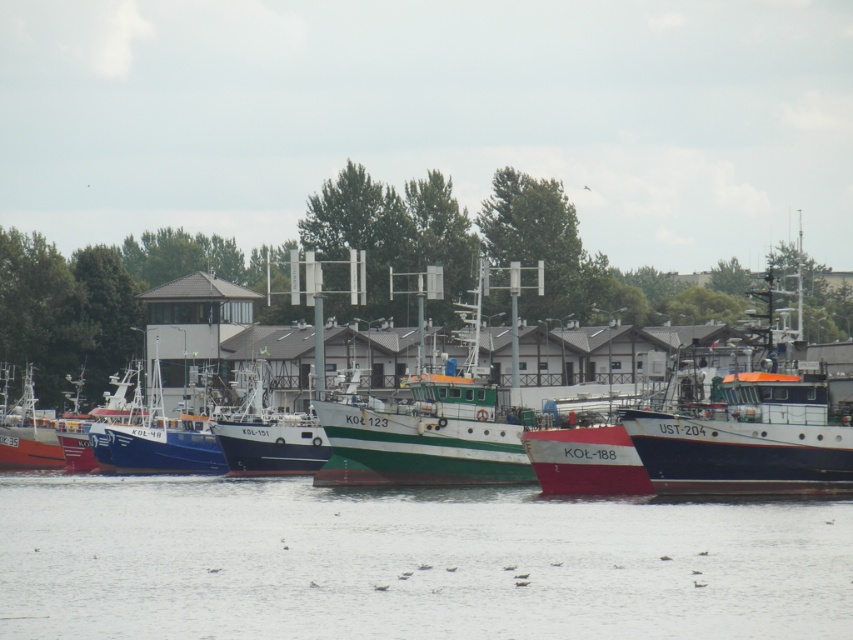
You are standing at the edge of the marina and want to board the green matte boat at center. The clear water at center is between you and the boat. Can you step onto the boat without getting your feet wet?

The clear water at center is 24.33 meters away from the green matte boat at center, so you would have to walk through 24.33 meters of water to reach the boat. This distance is too far to step onto the boat without getting your feet wet.

You are a boat operator who needs to navigate through the marina. You see the clear water at center and the green matte boat at center. Which object is smaller in size?

The clear water at center has a smaller size compared to the green matte boat at center.

Consider the image. You are standing at the pier and see the green matte boat at center and the blue matte boat at center. Which boat is positioned to the right of the other?

The green matte boat at center is positioned to the right of the blue matte boat at center.